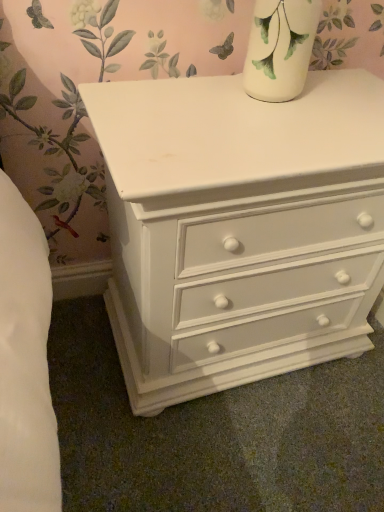
The width and height of the screenshot is (384, 512). What do you see at coordinates (239, 228) in the screenshot?
I see `white painted wood chest of drawers at center` at bounding box center [239, 228].

At what (x,y) coordinates should I click in order to perform the action: click on white painted wood chest of drawers at center. Please return your answer as a coordinate pair (x, y). Looking at the image, I should click on (239, 228).

At what (x,y) coordinates should I click in order to perform the action: click on white painted wood chest of drawers at center. Please return your answer as a coordinate pair (x, y). This screenshot has height=512, width=384. Looking at the image, I should click on (239, 228).